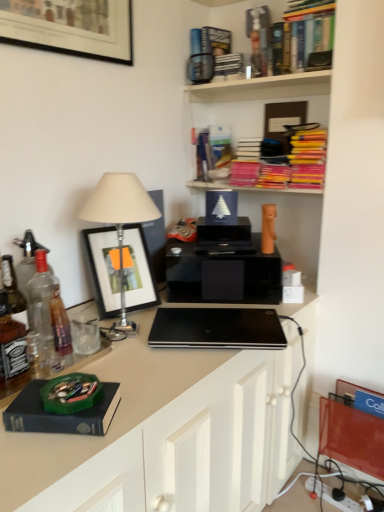
Question: From the image's perspective, is white plastic power strip at lower right on top of hardcover book at upper center, the 2th book ordered from the bottom?

Choices:
 (A) yes
 (B) no

Answer: (B)

Question: Is white plastic power strip at lower right facing away from hardcover book at upper center, the 2th book ordered from the bottom?

Choices:
 (A) yes
 (B) no

Answer: (B)

Question: From a real-world perspective, is white plastic power strip at lower right physically above hardcover book at upper center, the 2th book ordered from the bottom?

Choices:
 (A) yes
 (B) no

Answer: (B)

Question: Is white plastic power strip at lower right closer to camera compared to hardcover book at upper center, which is the 3th book in top-to-bottom order?

Choices:
 (A) no
 (B) yes

Answer: (B)

Question: Considering the relative positions of white plastic power strip at lower right and hardcover book at upper center, which is the 3th book in top-to-bottom order, in the image provided, is white plastic power strip at lower right to the right of hardcover book at upper center, which is the 3th book in top-to-bottom order, from the viewer's perspective?

Choices:
 (A) no
 (B) yes

Answer: (B)

Question: Is white plastic power strip at lower right located outside hardcover book at upper center, which is the 3th book in top-to-bottom order?

Choices:
 (A) no
 (B) yes

Answer: (B)

Question: Is hardcover book at upper center, the 2th book ordered from the bottom, further to camera compared to wooden bookshelf at upper center, marked as the second shelf in a bottom-to-top arrangement?

Choices:
 (A) no
 (B) yes

Answer: (B)

Question: Are hardcover book at upper center, which is the 3th book in top-to-bottom order, and wooden bookshelf at upper center, which ranks as the 2th shelf in top-to-bottom order, beside each other?

Choices:
 (A) no
 (B) yes

Answer: (A)

Question: Is hardcover book at upper center, which is the 3th book in top-to-bottom order, turned away from wooden bookshelf at upper center, which ranks as the 2th shelf in top-to-bottom order?

Choices:
 (A) no
 (B) yes

Answer: (A)

Question: Is there a large distance between hardcover book at upper center, the 2th book ordered from the bottom, and wooden bookshelf at upper center, marked as the second shelf in a bottom-to-top arrangement?

Choices:
 (A) no
 (B) yes

Answer: (A)

Question: Could you tell me if hardcover book at upper center, the 2th book ordered from the bottom, is turned towards wooden bookshelf at upper center, which ranks as the 2th shelf in top-to-bottom order?

Choices:
 (A) yes
 (B) no

Answer: (B)

Question: Is wooden bookshelf at upper center, which ranks as the 2th shelf in top-to-bottom order, located within hardcover book at upper center, which is the 3th book in top-to-bottom order?

Choices:
 (A) yes
 (B) no

Answer: (B)

Question: Is pink matte books at upper center, arranged as the first shelf when ordered from the bottom, looking in the opposite direction of clear glass bottle at left?

Choices:
 (A) no
 (B) yes

Answer: (A)